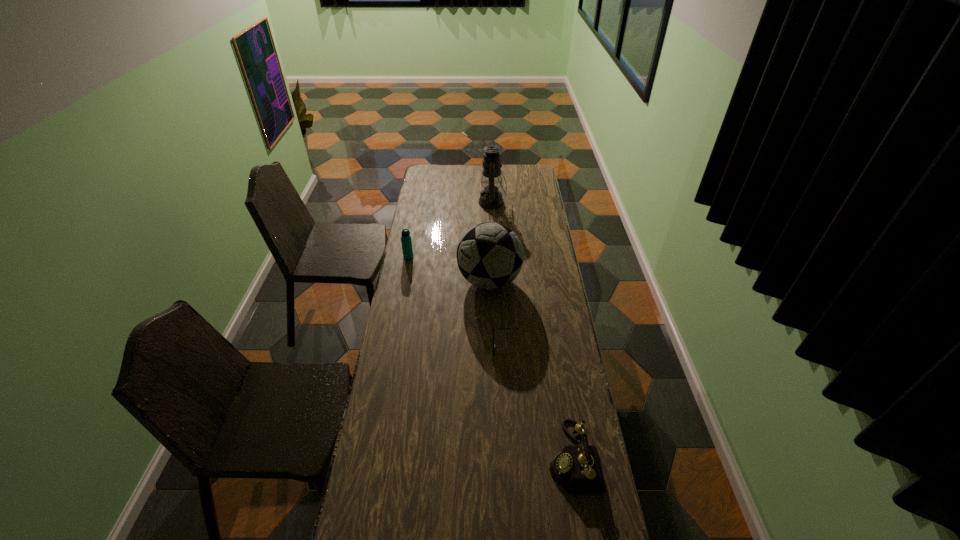
In order to click on free space located on the surface of the third farthest object where the brand logo is visible in this screenshot , I will do `click(400, 281)`.

At what (x,y) coordinates should I click in order to perform the action: click on blank space located 0.210m on the surface of the third farthest object where the brand logo is visible. Please return your answer as a coordinate pair (x, y). Looking at the image, I should click on (412, 281).

This screenshot has width=960, height=540. Find the location of `free space located on the surface of the third farthest object where the brand logo is visible`. free space located on the surface of the third farthest object where the brand logo is visible is located at coordinates (434, 281).

Image resolution: width=960 pixels, height=540 pixels. In order to click on vacant space located 0.310m on the back of the water bottle in this screenshot , I will do `click(416, 218)`.

What are the coordinates of `blank space located on the dial of the rightmost object` in the screenshot? It's located at (441, 457).

The width and height of the screenshot is (960, 540). I want to click on blank space located on the dial of the rightmost object, so click(460, 457).

Image resolution: width=960 pixels, height=540 pixels. I want to click on free space located on the dial of the rightmost object, so click(469, 457).

Locate an element on the screen. The height and width of the screenshot is (540, 960). free space located through the lenses of the spectacles is located at coordinates (462, 347).

Identify the location of free region located 0.310m through the lenses of the spectacles. The width and height of the screenshot is (960, 540). [414, 347].

Identify the location of free point located 0.400m through the lenses of the spectacles. (391, 347).